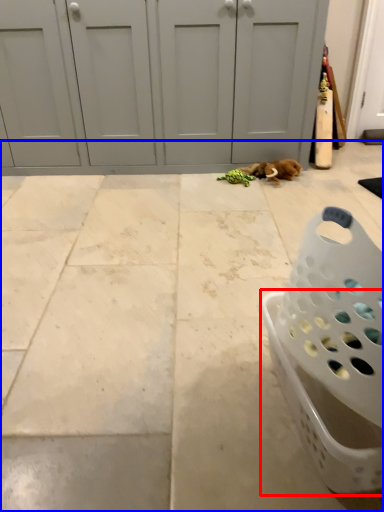
Question: Which of the following is the farthest to the observer, basket (highlighted by a red box) or concrete (highlighted by a blue box)?

Choices:
 (A) basket
 (B) concrete

Answer: (B)